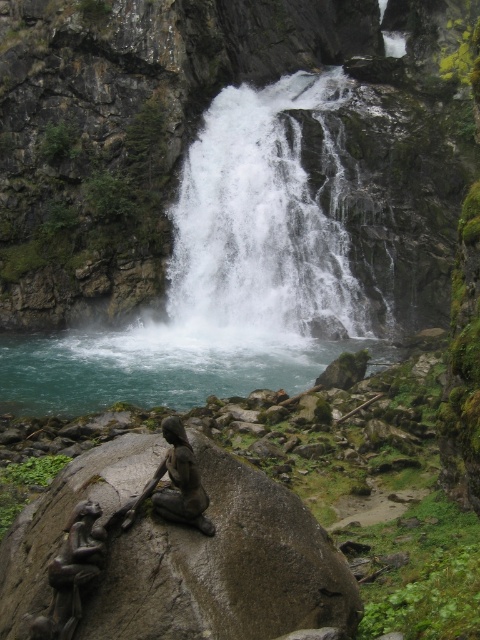
Between teal smooth water at center and bronze statue at center, which one has less height?

Standing shorter between the two is bronze statue at center.

Find the location of `teal smooth water at center`. teal smooth water at center is located at coordinates (157, 365).

Is white frothy water at center positioned before teal smooth water at center?

No, white frothy water at center is further to the viewer.

Between point (247, 177) and point (183, 380), which one is positioned behind?

Positioned behind is point (247, 177).

Where is `white frothy water at center`? The width and height of the screenshot is (480, 640). white frothy water at center is located at coordinates (262, 221).

Between point (277, 557) and point (312, 292), which one is positioned in front?

Point (277, 557)

Does point (27, 513) lie in front of point (214, 294)?

Yes, it is in front of point (214, 294).

The height and width of the screenshot is (640, 480). Find the location of `smooth gray rock at center`. smooth gray rock at center is located at coordinates (180, 554).